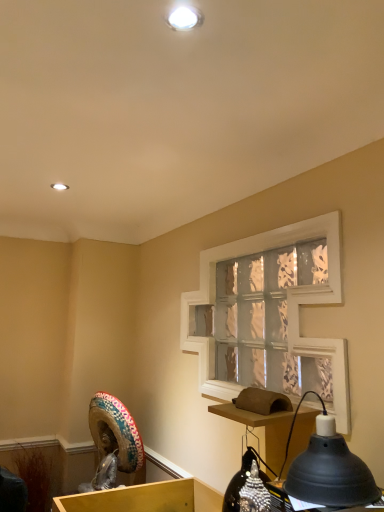
Question: Is matte white recessed light at upper center bigger than brown cardboard table at lower right?

Choices:
 (A) no
 (B) yes

Answer: (A)

Question: Does matte white recessed light at upper center appear on the right side of brown cardboard table at lower right?

Choices:
 (A) no
 (B) yes

Answer: (A)

Question: Is the surface of matte white recessed light at upper center in direct contact with brown cardboard table at lower right?

Choices:
 (A) no
 (B) yes

Answer: (A)

Question: Can you confirm if matte white recessed light at upper center is taller than brown cardboard table at lower right?

Choices:
 (A) no
 (B) yes

Answer: (A)

Question: Is matte white recessed light at upper center shorter than brown cardboard table at lower right?

Choices:
 (A) no
 (B) yes

Answer: (B)

Question: Does point (112, 428) appear closer or farther from the camera than point (56, 187)?

Choices:
 (A) farther
 (B) closer

Answer: (A)

Question: In the image, is multicolored fabric sombrero at lower left positioned in front of or behind matte white recessed light at upper center?

Choices:
 (A) front
 (B) behind

Answer: (B)

Question: From a real-world perspective, relative to matte white recessed light at upper center, is multicolored fabric sombrero at lower left vertically above or below?

Choices:
 (A) above
 (B) below

Answer: (B)

Question: Based on their sizes in the image, would you say multicolored fabric sombrero at lower left is bigger or smaller than matte white recessed light at upper center?

Choices:
 (A) big
 (B) small

Answer: (A)

Question: Does point (57, 189) appear closer or farther from the camera than point (210, 412)?

Choices:
 (A) farther
 (B) closer

Answer: (A)

Question: Is matte white recessed light at upper center bigger or smaller than brown cardboard table at lower right?

Choices:
 (A) small
 (B) big

Answer: (A)

Question: In terms of height, does matte white recessed light at upper center look taller or shorter compared to brown cardboard table at lower right?

Choices:
 (A) tall
 (B) short

Answer: (B)

Question: In the image, is matte white recessed light at upper center on the left side or the right side of brown cardboard table at lower right?

Choices:
 (A) right
 (B) left

Answer: (B)

Question: Is point (228, 254) closer or farther from the camera than point (59, 182)?

Choices:
 (A) farther
 (B) closer

Answer: (A)

Question: In terms of width, does clear glass window screen at center look wider or thinner when compared to matte white recessed light at upper center?

Choices:
 (A) wide
 (B) thin

Answer: (A)